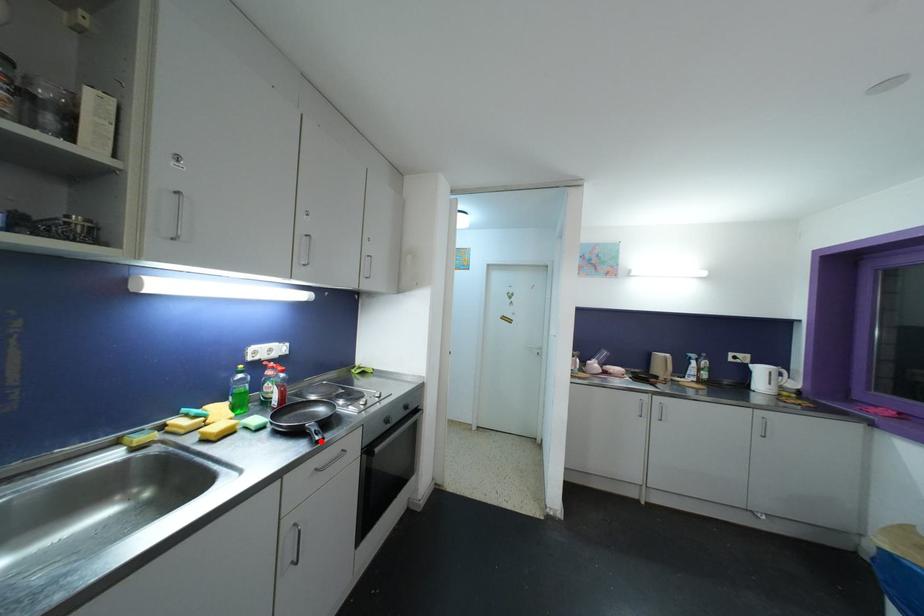
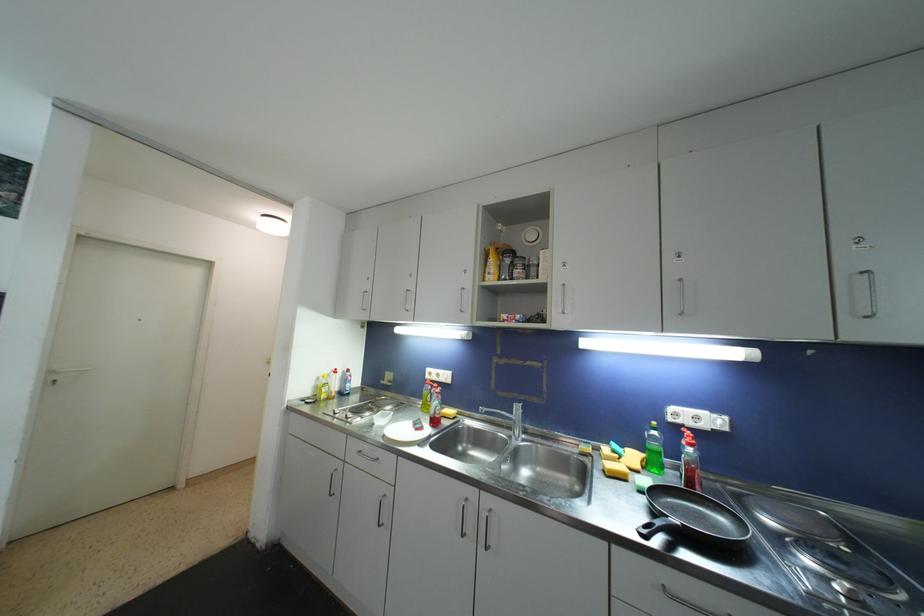
Find the pixel in the second image that matches the highlighted location in the first image.

(648, 533)